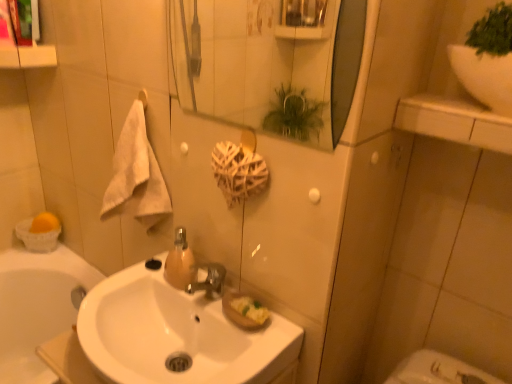
Question: In terms of size, does white glossy sink at upper right appear bigger or smaller than translucent amber glass soap dispenser at center?

Choices:
 (A) small
 (B) big

Answer: (B)

Question: From their relative heights in the image, would you say white glossy sink at upper right is taller or shorter than translucent amber glass soap dispenser at center?

Choices:
 (A) tall
 (B) short

Answer: (B)

Question: Considering the real-world distances, which object is farthest from the glossy glass mirror at upper center?

Choices:
 (A) translucent amber glass soap dispenser at center
 (B) white glossy sink at center
 (C) white glossy sink at upper right
 (D) white fluffy towel at left

Answer: (A)

Question: Which object is the farthest from the white fluffy towel at left?

Choices:
 (A) glossy glass mirror at upper center
 (B) white glossy sink at center
 (C) translucent amber glass soap dispenser at center
 (D) white glossy sink at upper right

Answer: (A)